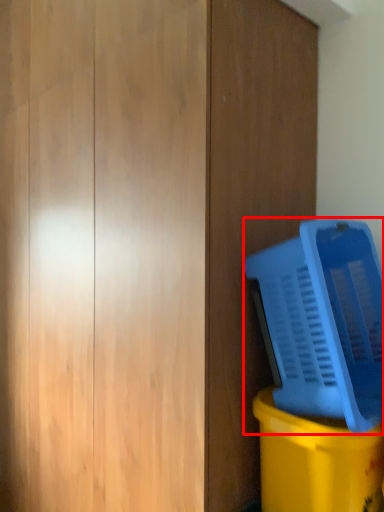
Question: From the image's perspective, considering the relative positions of water cooler (annotated by the red box) and waste container in the image provided, where is water cooler (annotated by the red box) located with respect to the staircase?

Choices:
 (A) below
 (B) above

Answer: (B)